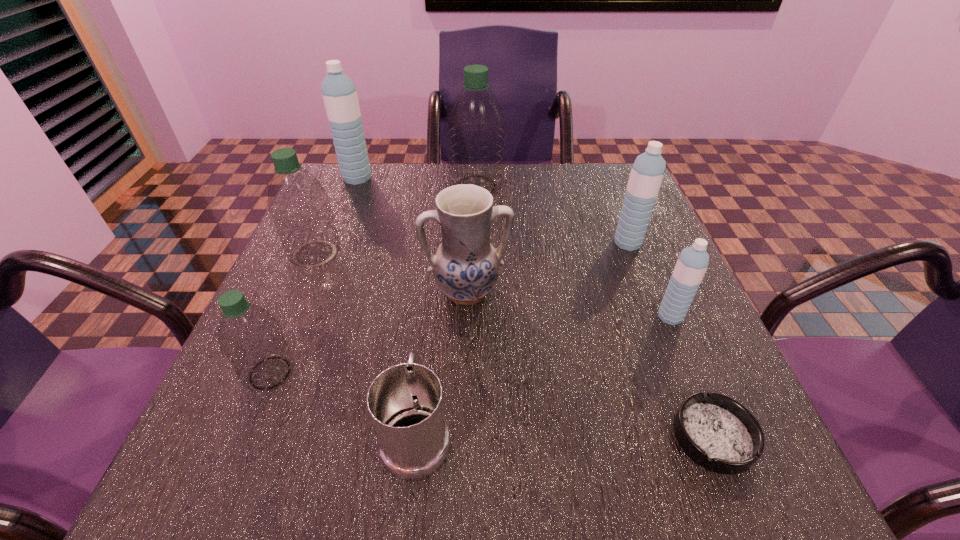
You are a GUI agent. You are given a task and a screenshot of the screen. Output one action in this format:
    pyautogui.click(x=<x>, y=<y>)
    Task: Click on the vacant area between the second smallest blue water bottle and the smallest green water bottle
    
    Given the screenshot: What is the action you would take?
    pyautogui.click(x=449, y=308)

In order to click on free area in between the ashtray and the farthest green water bottle in this screenshot , I will do `click(595, 312)`.

In order to click on empty location between the ashtray and the smallest green water bottle in this screenshot , I will do `click(492, 405)`.

Where is `vacant area between the ashtray and the second smallest blue water bottle`? This screenshot has height=540, width=960. vacant area between the ashtray and the second smallest blue water bottle is located at coordinates (x=670, y=340).

Locate an element on the screen. The image size is (960, 540). empty location between the dark ashtray and the blue pottery is located at coordinates (590, 364).

Find the location of a particular element. Image resolution: width=960 pixels, height=540 pixels. object that ranks as the seventh closest to the nearest blue water bottle is located at coordinates (298, 204).

Locate which object ranks third in proximity to the nearest water bottle. Please provide its 2D coordinates. Your answer should be formatted as a tuple, i.e. [(x, y)], where the tuple contains the x and y coordinates of a point satisfying the conditions above.

[(465, 267)]

What are the coordinates of `the second closest water bottle to the rightmost green water bottle` in the screenshot? It's located at (298, 204).

The width and height of the screenshot is (960, 540). Find the location of `water bottle object that ranks as the second closest to the second shortest object`. water bottle object that ranks as the second closest to the second shortest object is located at coordinates (298, 204).

The height and width of the screenshot is (540, 960). In order to click on green water bottle that can be found as the closest to the biggest green water bottle in this screenshot , I will do `click(298, 204)`.